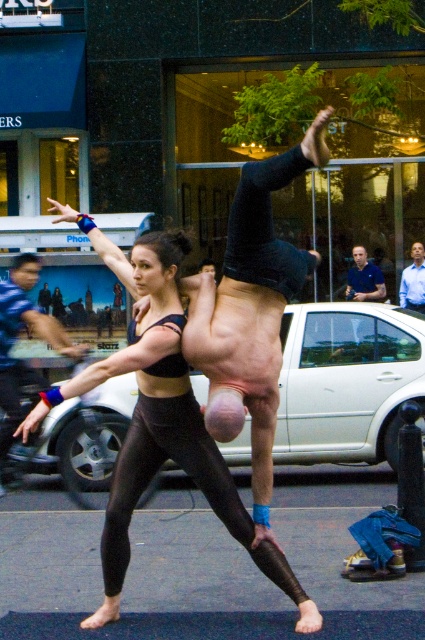
Image resolution: width=425 pixels, height=640 pixels. What do you see at coordinates (161, 422) in the screenshot? I see `black matte leggings at center` at bounding box center [161, 422].

Which of these two, black matte leggings at center or blue shirt at center, stands shorter?

With less height is blue shirt at center.

Which is in front, point (295, 582) or point (365, 273)?

Point (295, 582)

Where is `black matte leggings at center`? The image size is (425, 640). black matte leggings at center is located at coordinates (161, 422).

Between matte black tank top at center and blue shirt at center, which one appears on the right side from the viewer's perspective?

blue shirt at center is more to the right.

Which is below, matte black tank top at center or blue shirt at center?

matte black tank top at center is lower down.

Between point (76, 348) and point (363, 275), which one is positioned in front?

Positioned in front is point (76, 348).

Locate an element on the screen. matte black tank top at center is located at coordinates (16, 337).

Is blue shirt at center above blue shirt at upper right?

Correct, blue shirt at center is located above blue shirt at upper right.

What do you see at coordinates (363, 278) in the screenshot?
I see `blue shirt at center` at bounding box center [363, 278].

Identify the location of blue shirt at center. point(363,278).